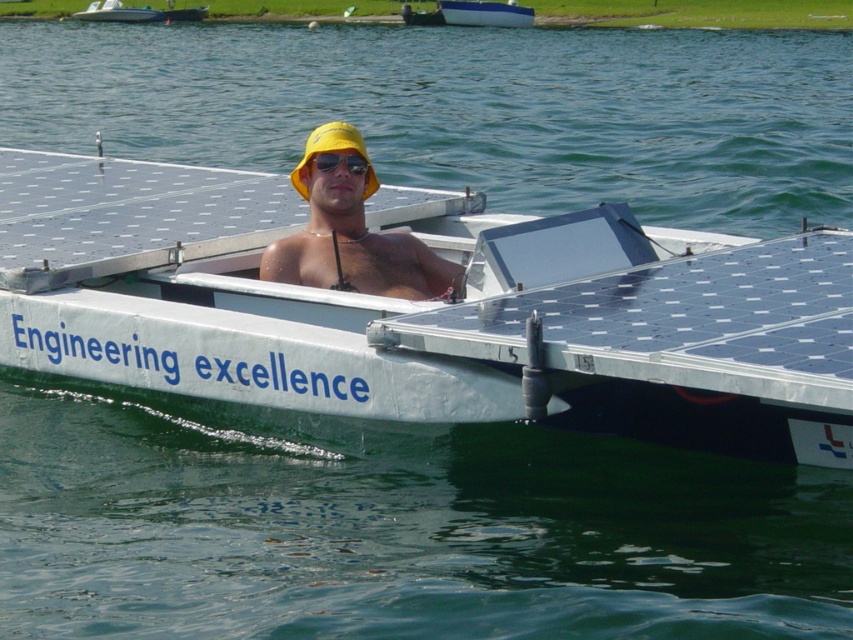
Is white metallic boat at center below yellow matte hat at center?

Yes, white metallic boat at center is below yellow matte hat at center.

Consider the image. Which is above, white metallic boat at center or yellow matte hat at center?

yellow matte hat at center is higher up.

Where is `white metallic boat at center`? This screenshot has width=853, height=640. white metallic boat at center is located at coordinates (428, 310).

Who is positioned more to the left, yellow matte hat at center or black reflective sunglasses at center?

Positioned to the left is black reflective sunglasses at center.

Find the location of a particular element. yellow matte hat at center is located at coordinates (352, 236).

Is point (354, 243) closer to camera compared to point (350, 161)?

That is False.

Identify the location of yellow matte hat at center. Image resolution: width=853 pixels, height=640 pixels. (352, 236).

Between point (573, 308) and point (502, 20), which one is positioned behind?

The point (502, 20) is more distant.

Is white metallic boat at center shorter than blue glossy boat at upper center?

Yes.

Which is in front, point (624, 324) or point (511, 24)?

Point (624, 324) is more forward.

You are a GUI agent. You are given a task and a screenshot of the screen. Output one action in this format:
    pyautogui.click(x=<x>, y=<y>)
    Task: Click on the white metallic boat at center
    Image resolution: width=853 pixels, height=640 pixels.
    Given the screenshot: What is the action you would take?
    pyautogui.click(x=428, y=310)